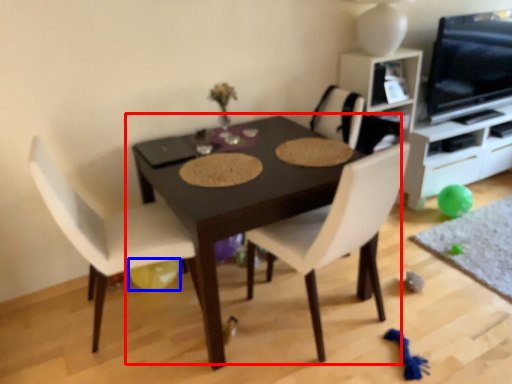
Question: Which point is closer to the camera, table (highlighted by a red box) or balloon (highlighted by a blue box)?

Choices:
 (A) table
 (B) balloon

Answer: (A)